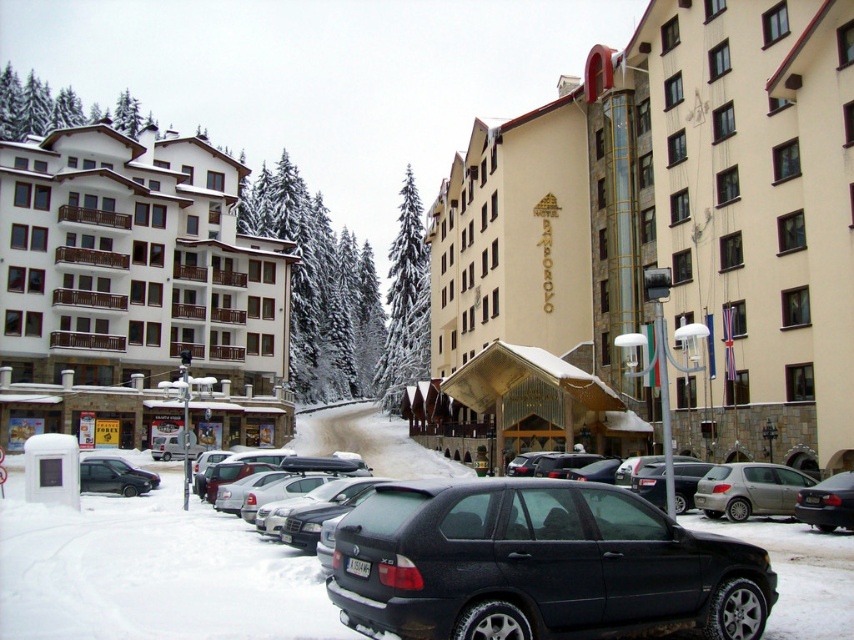
You are a photographer planning to capture the entire beige stone building at center and shiny black sedan at lower right in a single frame. Based on their sizes in the image, which object would require you to step back further to ensure both fit in the frame?

The beige stone building at center is wider than the shiny black sedan at lower right, so you would need to step back further to include both in the frame.

You are standing in the snowy parking lot and want to walk to the beige stone building at center. Based on the image, in which general direction should you head relative to your current position?

The beige stone building at center is located at coordinates approximately 0.345 on the x and 0.804 on the y axis, so you should head towards the center of the image to reach it.

You are standing at the point marked by the coordinates (749,490) in the image, which is the location of the silver metallic hatchback at center right. You want to walk towards the multi story building with light beige facade on the right side. Which direction should you head?

You should head towards the right side of the image, as the multi story building with light beige facade is located on the right side, and your current position is at the silver metallic hatchback at center right.